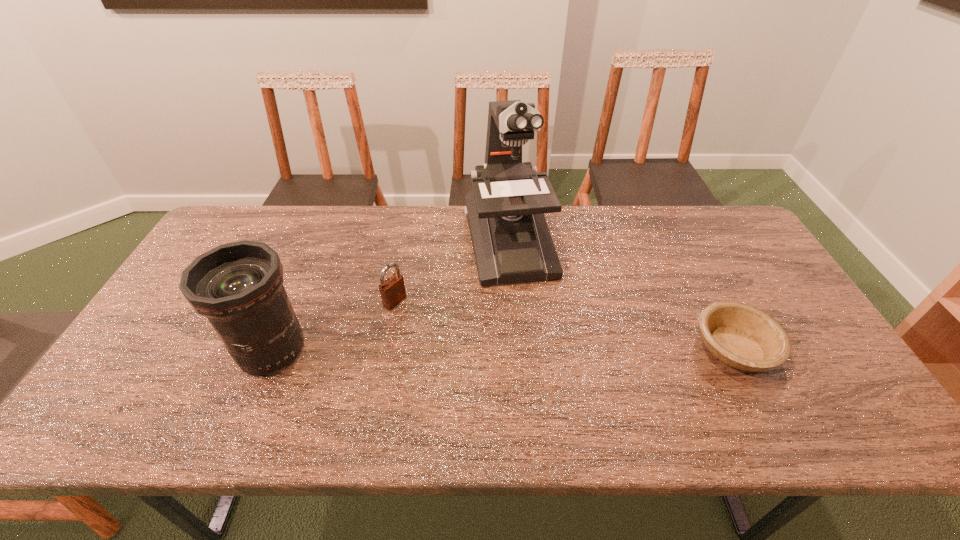
Locate an element on the screen. The image size is (960, 540). free space located 0.170m through the eyepieces of the farthest object is located at coordinates (533, 333).

Find the location of a particular element. The width and height of the screenshot is (960, 540). vacant space located through the eyepieces of the farthest object is located at coordinates (527, 313).

This screenshot has width=960, height=540. In order to click on vacant area situated through the eyepieces of the farthest object in this screenshot , I will do `click(524, 305)`.

Identify the location of vacant space located 0.070m on the front-facing side of the second farthest object. (421, 319).

I want to click on vacant space located 0.340m on the front-facing side of the second farthest object, so click(x=503, y=369).

At what (x,y) coordinates should I click in order to perform the action: click on free location located 0.190m on the front-facing side of the second farthest object. Please return your answer as a coordinate pair (x, y). The width and height of the screenshot is (960, 540). Looking at the image, I should click on (455, 340).

Where is `object that is positioned at the far edge`? The width and height of the screenshot is (960, 540). object that is positioned at the far edge is located at coordinates (511, 240).

The width and height of the screenshot is (960, 540). I want to click on telephoto lens located at the near edge, so click(x=238, y=286).

The height and width of the screenshot is (540, 960). In order to click on bowl at the near edge in this screenshot , I will do `click(741, 336)`.

At what (x,y) coordinates should I click in order to perform the action: click on object that is at the right edge. Please return your answer as a coordinate pair (x, y). The image size is (960, 540). Looking at the image, I should click on (741, 336).